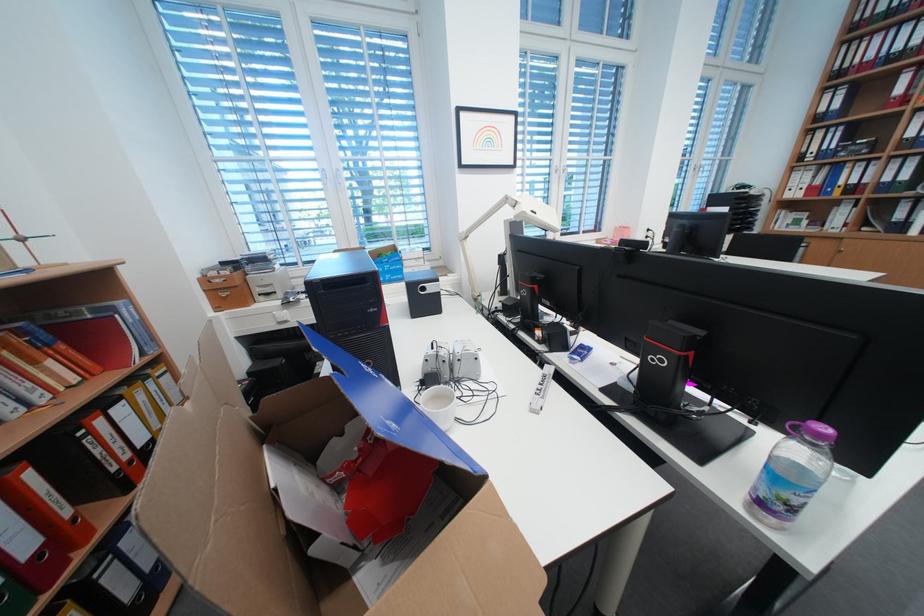
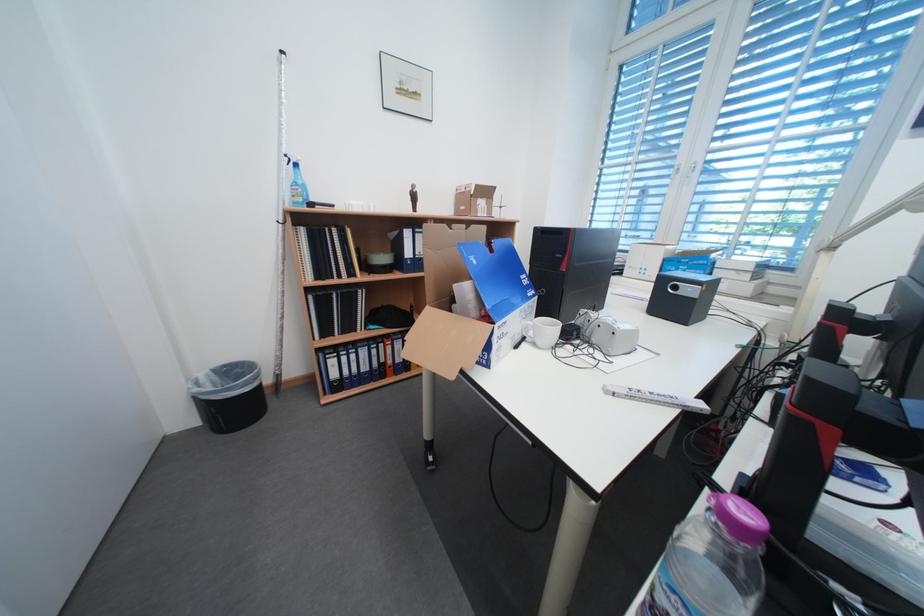
Find the pixel in the second image that matches point (558, 379) in the first image.

(685, 400)